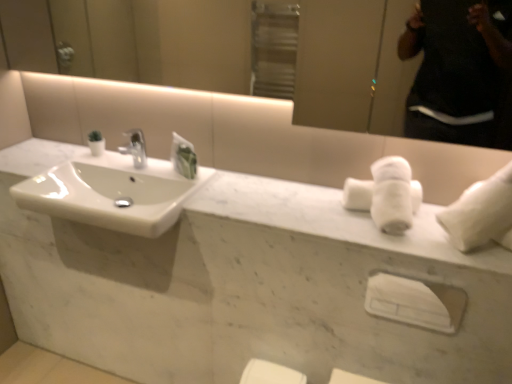
Question: Does white glossy sink at left have a larger size compared to white plastic towel bar at center?

Choices:
 (A) yes
 (B) no

Answer: (A)

Question: Considering the relative sizes of white glossy sink at left and white plastic towel bar at center in the image provided, is white glossy sink at left smaller than white plastic towel bar at center?

Choices:
 (A) no
 (B) yes

Answer: (A)

Question: Is white plastic towel bar at center a part of white glossy sink at left?

Choices:
 (A) no
 (B) yes

Answer: (A)

Question: Considering the relative sizes of white glossy sink at left and white plastic towel bar at center in the image provided, is white glossy sink at left thinner than white plastic towel bar at center?

Choices:
 (A) no
 (B) yes

Answer: (A)

Question: Does white glossy sink at left turn towards white plastic towel bar at center?

Choices:
 (A) no
 (B) yes

Answer: (A)

Question: Looking at their shapes, would you say white plastic towel bar at center is wider or thinner than white matte towel at right, which is the second bath towel in left-to-right order?

Choices:
 (A) wide
 (B) thin

Answer: (B)

Question: Considering the positions of point (x=417, y=314) and point (x=483, y=233), is point (x=417, y=314) closer or farther from the camera than point (x=483, y=233)?

Choices:
 (A) closer
 (B) farther

Answer: (B)

Question: From a real-world perspective, relative to white matte towel at right, which is the second bath towel in left-to-right order, is white plastic towel bar at center vertically above or below?

Choices:
 (A) above
 (B) below

Answer: (B)

Question: Do you think white plastic towel bar at center is within white matte towel at right, the 1th bath towel when ordered from right to left, or outside of it?

Choices:
 (A) outside
 (B) inside

Answer: (A)

Question: In terms of size, does white glossy sink at left appear bigger or smaller than white matte towel at right, the 1th bath towel when ordered from right to left?

Choices:
 (A) small
 (B) big

Answer: (B)

Question: From a real-world perspective, is white glossy sink at left positioned above or below white matte towel at right, which is the second bath towel in left-to-right order?

Choices:
 (A) above
 (B) below

Answer: (B)

Question: Is point (61, 208) closer or farther from the camera than point (455, 203)?

Choices:
 (A) farther
 (B) closer

Answer: (A)

Question: From the image's perspective, is white glossy sink at left above or below white matte towel at right, the 1th bath towel when ordered from right to left?

Choices:
 (A) below
 (B) above

Answer: (B)

Question: In terms of height, does white glossy sink at left look taller or shorter compared to white plastic towel bar at center?

Choices:
 (A) tall
 (B) short

Answer: (B)

Question: Visually, is white glossy sink at left positioned to the left or to the right of white plastic towel bar at center?

Choices:
 (A) right
 (B) left

Answer: (B)